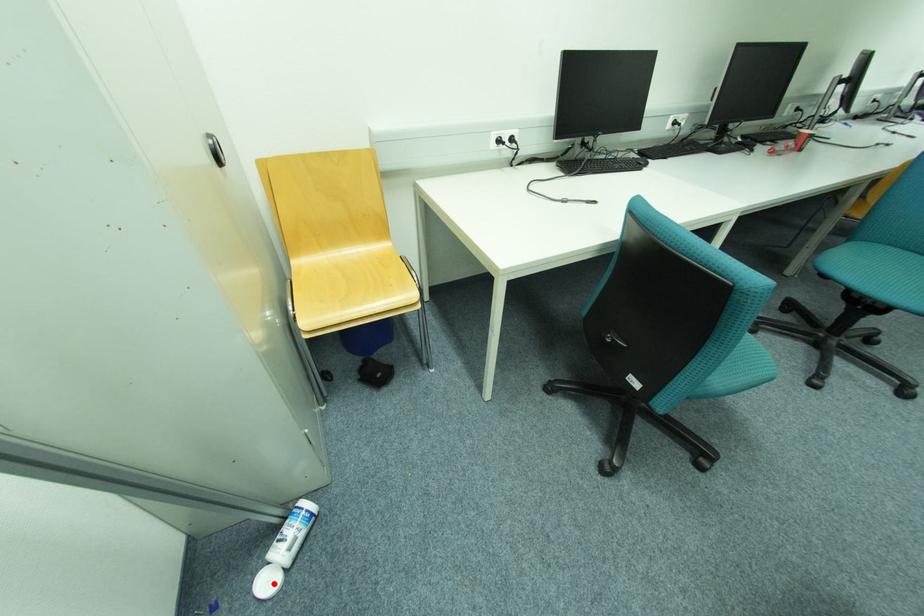
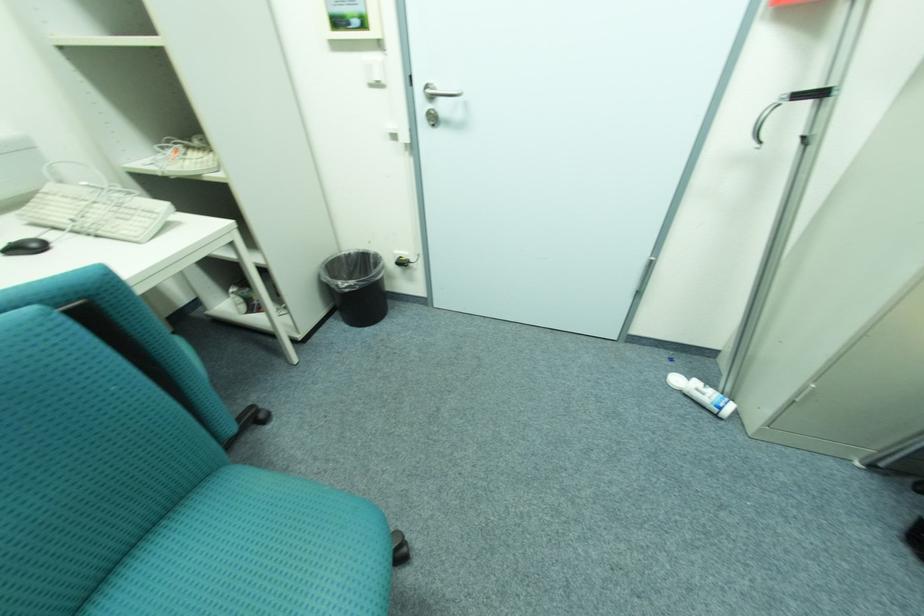
Find the pixel in the second image that matches the highlighted location in the first image.

(683, 381)